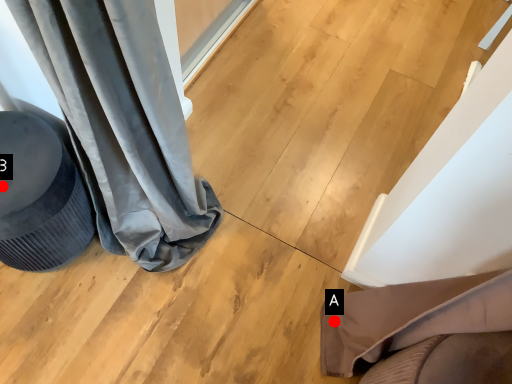
Question: Two points are circled on the image, labeled by A and B beside each circle. Among these points, which one is nearest to the camera?

Choices:
 (A) A is closer
 (B) B is closer

Answer: (B)